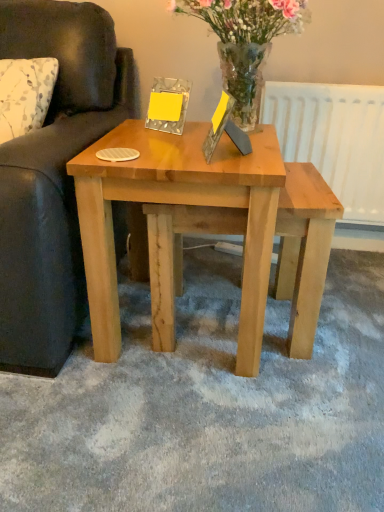
Question: From the image's perspective, is wooden picture frame at center under translucent glass vase at upper center?

Choices:
 (A) yes
 (B) no

Answer: (A)

Question: Considering the relative positions of wooden picture frame at center and translucent glass vase at upper center in the image provided, is wooden picture frame at center in front of translucent glass vase at upper center?

Choices:
 (A) no
 (B) yes

Answer: (B)

Question: From a real-world perspective, is wooden picture frame at center physically above translucent glass vase at upper center?

Choices:
 (A) yes
 (B) no

Answer: (B)

Question: Is wooden picture frame at center positioned with its back to translucent glass vase at upper center?

Choices:
 (A) no
 (B) yes

Answer: (A)

Question: Can you confirm if wooden picture frame at center is positioned to the left of translucent glass vase at upper center?

Choices:
 (A) yes
 (B) no

Answer: (A)

Question: Can we say wooden picture frame at center lies outside translucent glass vase at upper center?

Choices:
 (A) yes
 (B) no

Answer: (A)

Question: Would you say white matte radiator at upper right is part of wooden picture frame at center's contents?

Choices:
 (A) no
 (B) yes

Answer: (A)

Question: Can you confirm if wooden picture frame at center is bigger than white matte radiator at upper right?

Choices:
 (A) yes
 (B) no

Answer: (B)

Question: Would you consider wooden picture frame at center to be distant from white matte radiator at upper right?

Choices:
 (A) no
 (B) yes

Answer: (A)

Question: Does wooden picture frame at center come behind white matte radiator at upper right?

Choices:
 (A) no
 (B) yes

Answer: (A)

Question: From the image's perspective, is wooden picture frame at center below white matte radiator at upper right?

Choices:
 (A) no
 (B) yes

Answer: (B)

Question: Is wooden picture frame at center positioned with its back to white matte radiator at upper right?

Choices:
 (A) no
 (B) yes

Answer: (A)

Question: From a real-world perspective, is white matte radiator at upper right physically below wooden picture frame at center?

Choices:
 (A) yes
 (B) no

Answer: (A)